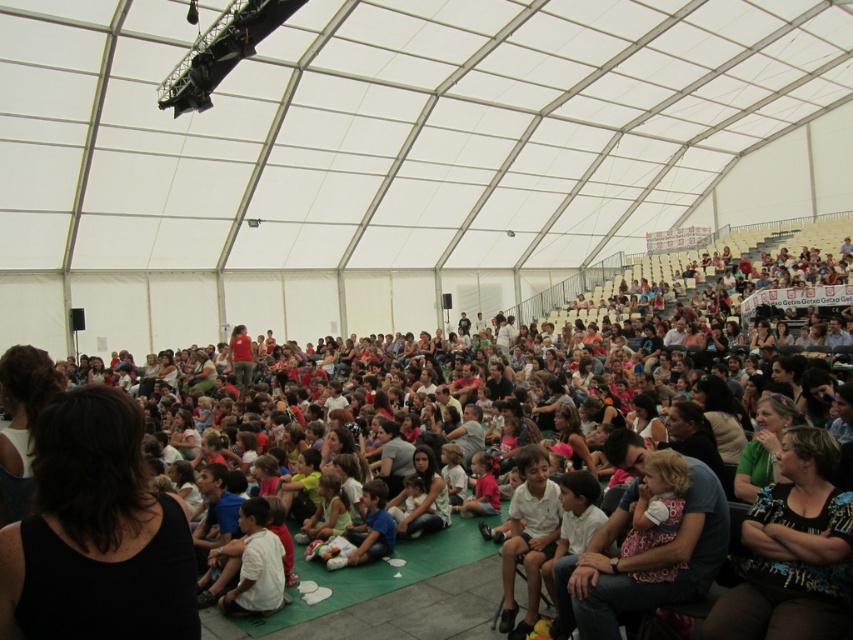
You are a photographer at the event and want to capture a photo of both the pink fabric dress at center and the matte black shirt at lower right. However, you need to ensure that neither of them is blocking the other. Based on the scene, can you position yourself in a way that both are visible without obstruction?

The pink fabric dress at center is in front of the matte black shirt at lower right. To capture both without obstruction, position yourself so that you can see the pink fabric dress at center in the foreground and the matte black shirt at lower right behind it, ensuring the dress does not fully block the shirt.

You are organizing a photo shoot and need to determine which clothing item takes up more horizontal space in the image. The pink fabric dress at center and the matte black shirt at lower right are both in the frame. Which one has a greater width?

The pink fabric dress at center has a greater width than the matte black shirt at lower right according to the description.

You are organizing a photo shoot and need to position two models wearing the pink fabric dress at center and the matte black shirt at lower right. Given their current positions, what is the minimum distance you need to move the model in the matte black shirt to ensure they are exactly 10 feet apart?

The pink fabric dress at center is currently 8.58 feet from the matte black shirt at lower right. To achieve a distance of 10 feet, the matte black shirt at lower right needs to be moved an additional 1.42 feet away from the pink fabric dress at center.